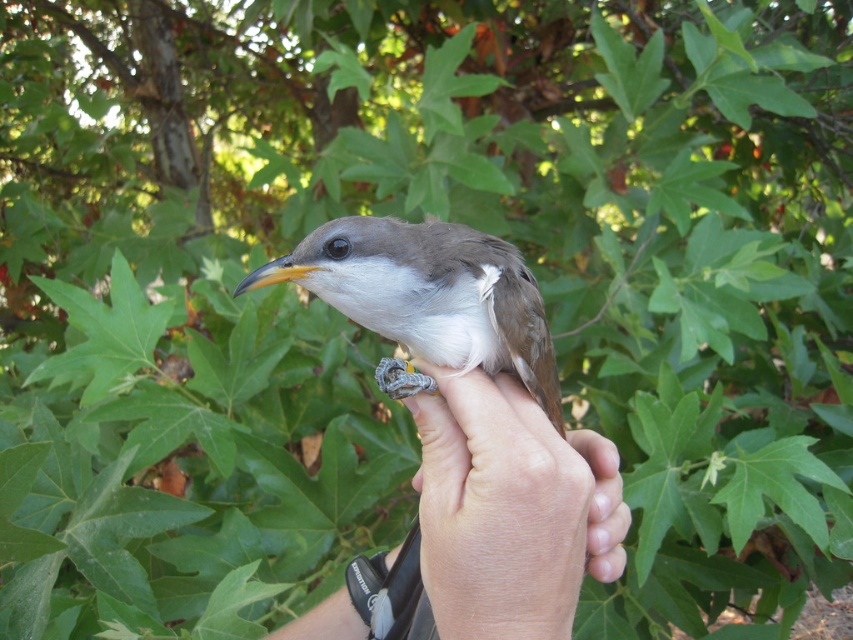
Between smooth skin hand at center and brown matte bird at center, which one is positioned lower?

smooth skin hand at center

Measure the distance between point (426, 564) and camera.

They are 56.08 centimeters apart.

Describe the element at coordinates (509, 509) in the screenshot. I see `smooth skin hand at center` at that location.

Find the location of a particular element. smooth skin hand at center is located at coordinates (509, 509).